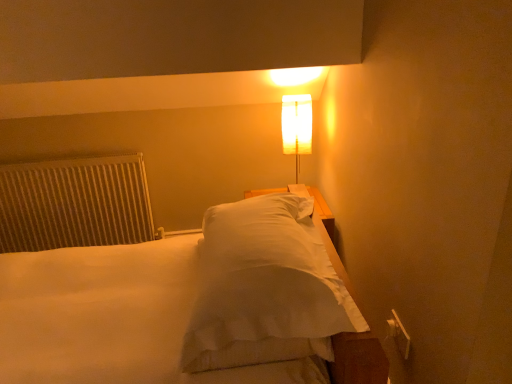
Question: From a real-world perspective, is white fabric lamp at upper center beneath white soft bed at center?

Choices:
 (A) yes
 (B) no

Answer: (B)

Question: Does white fabric lamp at upper center have a greater width compared to white soft bed at center?

Choices:
 (A) no
 (B) yes

Answer: (A)

Question: Is white fabric lamp at upper center further to the viewer compared to white soft bed at center?

Choices:
 (A) no
 (B) yes

Answer: (B)

Question: Would you say white fabric lamp at upper center is a long distance from white soft bed at center?

Choices:
 (A) no
 (B) yes

Answer: (B)

Question: Is the depth of white fabric lamp at upper center less than that of white soft bed at center?

Choices:
 (A) yes
 (B) no

Answer: (B)

Question: Looking at their shapes, would you say white fabric lamp at upper center is wider or thinner than white textured radiator at left?

Choices:
 (A) thin
 (B) wide

Answer: (B)

Question: Would you say white fabric lamp at upper center is inside or outside white textured radiator at left?

Choices:
 (A) inside
 (B) outside

Answer: (B)

Question: From the image's perspective, is white fabric lamp at upper center above or below white textured radiator at left?

Choices:
 (A) below
 (B) above

Answer: (B)

Question: In terms of size, does white fabric lamp at upper center appear bigger or smaller than white textured radiator at left?

Choices:
 (A) big
 (B) small

Answer: (B)

Question: Does point (145, 231) appear closer or farther from the camera than point (298, 97)?

Choices:
 (A) closer
 (B) farther

Answer: (B)

Question: Looking at their shapes, would you say white textured radiator at left is wider or thinner than white fabric lamp at upper center?

Choices:
 (A) wide
 (B) thin

Answer: (B)

Question: Is white textured radiator at left situated inside white fabric lamp at upper center or outside?

Choices:
 (A) inside
 (B) outside

Answer: (B)

Question: From a real-world perspective, is white textured radiator at left above or below white fabric lamp at upper center?

Choices:
 (A) below
 (B) above

Answer: (A)

Question: Based on their sizes in the image, would you say white fabric lamp at upper center is bigger or smaller than white soft bed at center?

Choices:
 (A) big
 (B) small

Answer: (B)

Question: From a real-world perspective, is white fabric lamp at upper center positioned above or below white soft bed at center?

Choices:
 (A) below
 (B) above

Answer: (B)